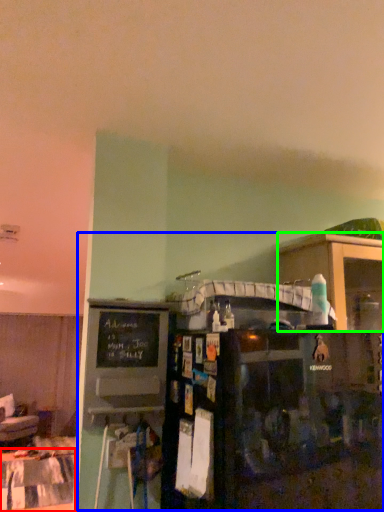
Question: Estimate the real-world distances between objects in this image. Which object is closer to table (highlighted by a red box), entertainment center (highlighted by a blue box) or shelf (highlighted by a green box)?

Choices:
 (A) entertainment center
 (B) shelf

Answer: (A)